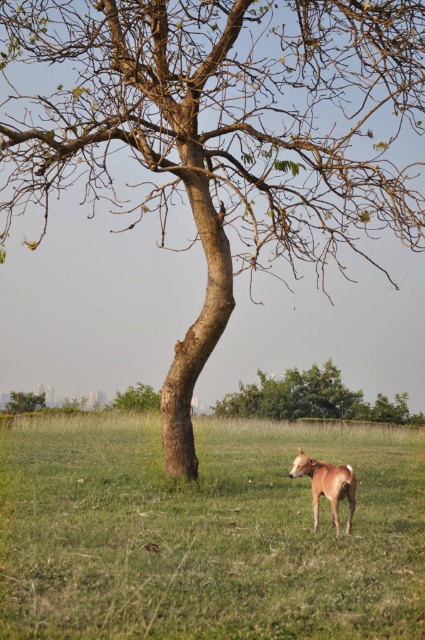
Between point (195, 436) and point (342, 499), which one is positioned in front?

Point (342, 499)

The width and height of the screenshot is (425, 640). What do you see at coordinates (206, 532) in the screenshot?
I see `brown fur dog at center` at bounding box center [206, 532].

Who is more distant from viewer, (121, 630) or (302, 467)?

The point (302, 467) is more distant.

The image size is (425, 640). In order to click on brown fur dog at center in this screenshot , I will do `click(206, 532)`.

Is brown furry pony at lower center to the right of green leafy tree at upper left from the viewer's perspective?

Yes, brown furry pony at lower center is to the right of green leafy tree at upper left.

Does brown furry pony at lower center appear under green leafy tree at upper left?

Incorrect, brown furry pony at lower center is not positioned below green leafy tree at upper left.

This screenshot has width=425, height=640. I want to click on brown furry pony at lower center, so click(326, 486).

Can you confirm if green leafy tree at center is bigger than green leafy tree at upper left?

Actually, green leafy tree at center might be smaller than green leafy tree at upper left.

Is point (294, 413) more distant than point (42, 401)?

Yes.

Which is in front, point (274, 394) or point (39, 406)?

Point (39, 406) is more forward.

At what (x,y) coordinates should I click in order to perform the action: click on green leafy tree at center. Please return your answer as a coordinate pair (x, y). Image resolution: width=425 pixels, height=640 pixels. Looking at the image, I should click on (312, 397).